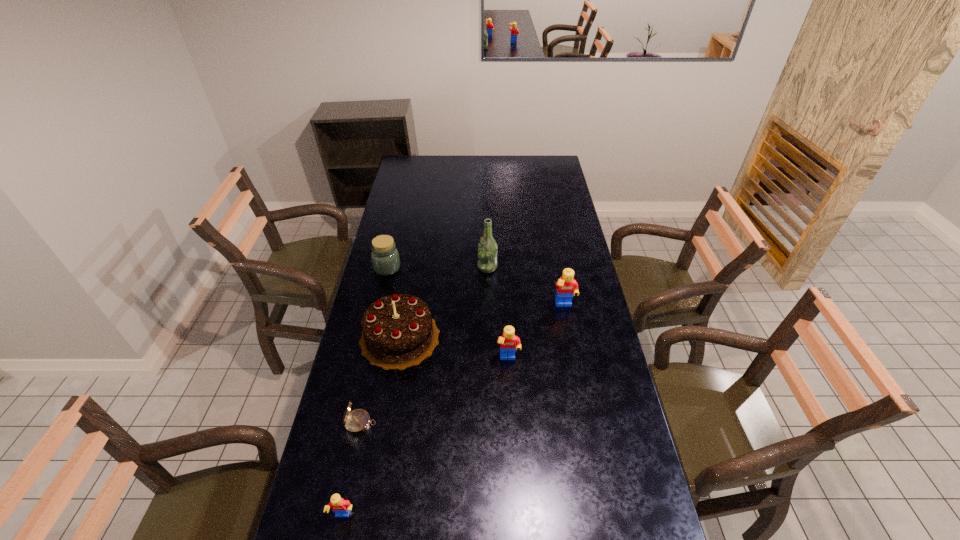
Locate which Lego is the closest to the leftmost Lego. Please provide its 2D coordinates. Your answer should be formatted as a tuple, i.e. [(x, y)], where the tuple contains the x and y coordinates of a point satisfying the conditions above.

[(509, 343)]

Find the location of a particular element. The width and height of the screenshot is (960, 540). free space that satisfies the following two spatial constraints: 1. on the surface of the tallest object; 2. on the face of the leftmost Lego is located at coordinates (492, 516).

At what (x,y) coordinates should I click in order to perform the action: click on vacant space that satisfies the following two spatial constraints: 1. on the surface of the tallest object; 2. on the front side of the birthday cake. Please return your answer as a coordinate pair (x, y). This screenshot has height=540, width=960. Looking at the image, I should click on [489, 337].

The width and height of the screenshot is (960, 540). In order to click on free point that satisfies the following two spatial constraints: 1. on the surface of the beer bottle; 2. on the front side of the birthday cake in this screenshot , I will do `click(489, 337)`.